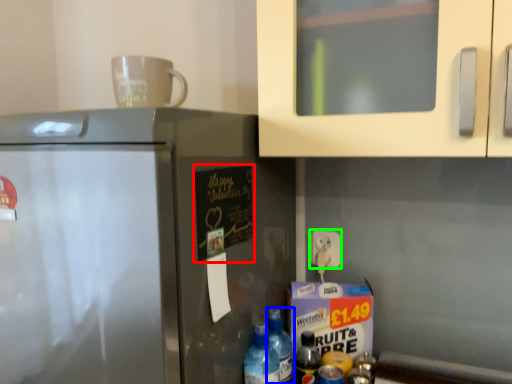
Question: Considering the real-world distances, which object is farthest from bulletin board (highlighted by a red box)? bottle (highlighted by a blue box) or electric outlet (highlighted by a green box)?

Choices:
 (A) bottle
 (B) electric outlet

Answer: (B)